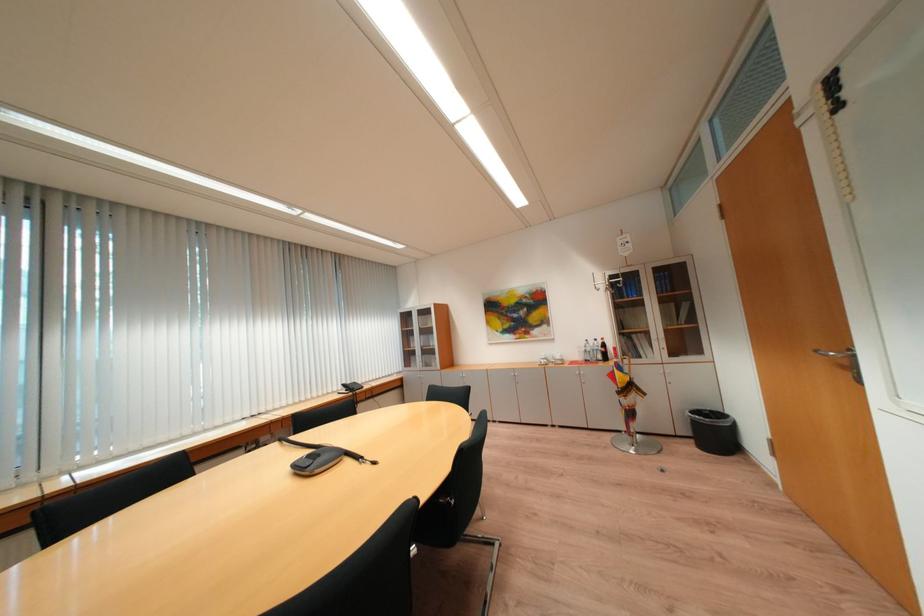
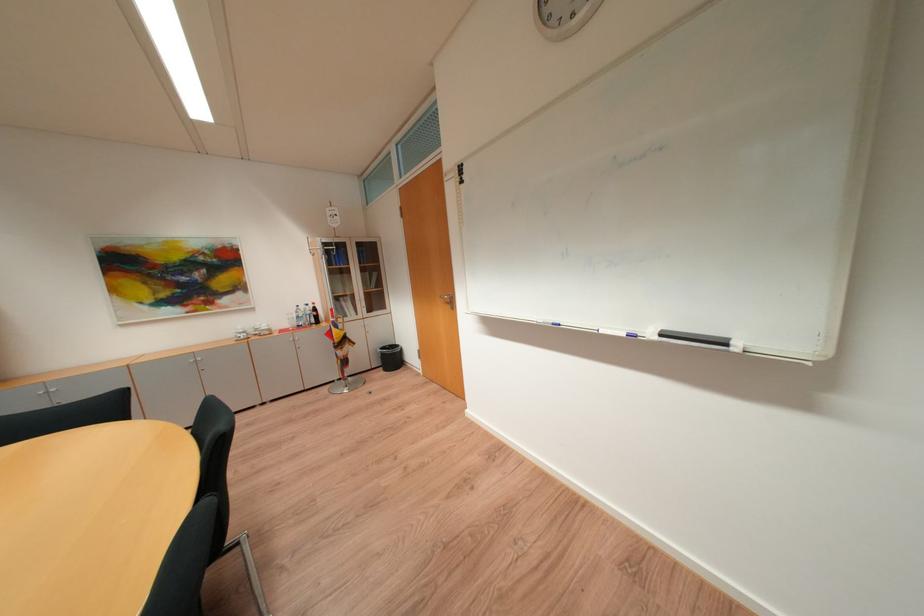
The point at (x=621, y=377) is marked in the first image. Where is the corresponding point in the second image?

(338, 334)